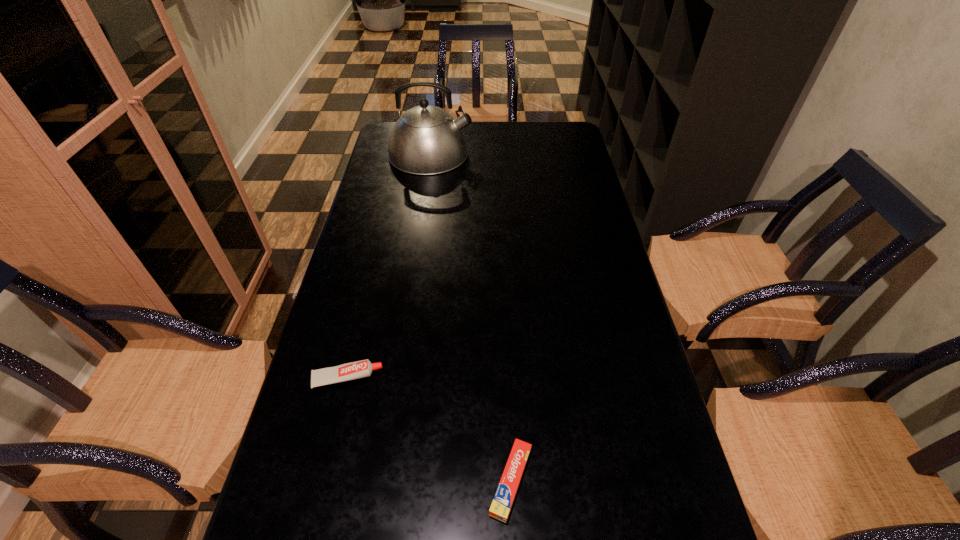
This screenshot has width=960, height=540. I want to click on vacant position in the image that satisfies the following two spatial constraints: 1. from the spout of the farthest object; 2. on the front side of the farther toothpaste, so click(396, 378).

The image size is (960, 540). Find the location of `vacant position in the image that satisfies the following two spatial constraints: 1. from the spout of the kettle; 2. on the left side of the nearest object`. vacant position in the image that satisfies the following two spatial constraints: 1. from the spout of the kettle; 2. on the left side of the nearest object is located at coordinates (381, 481).